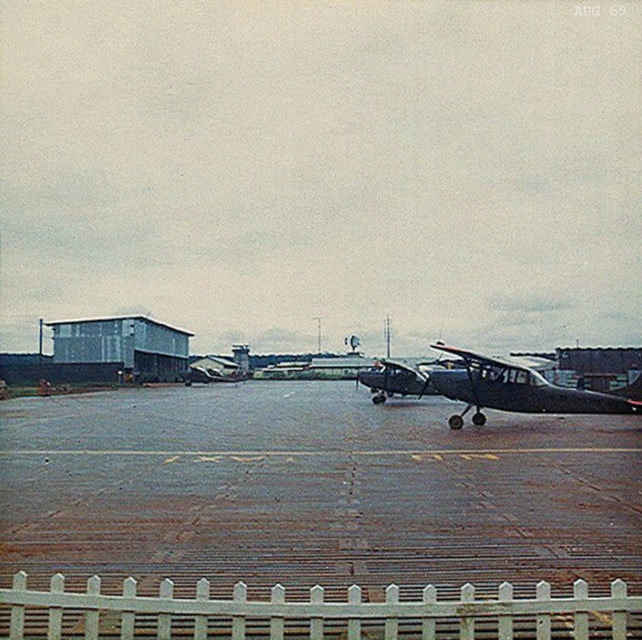
Can you confirm if dark gray asphalt runway at center is shorter than metallic gray airplane at center?

Indeed, dark gray asphalt runway at center has a lesser height compared to metallic gray airplane at center.

Can you confirm if dark gray asphalt runway at center is positioned to the left of metallic gray airplane at center?

Correct, you'll find dark gray asphalt runway at center to the left of metallic gray airplane at center.

Find the location of a particular element. Image resolution: width=642 pixels, height=640 pixels. dark gray asphalt runway at center is located at coordinates (313, 490).

Looking at this image, who is shorter, dark gray asphalt runway at center or metallic gray hangar at left?

With less height is dark gray asphalt runway at center.

Is point (578, 556) farther from viewer compared to point (137, 380)?

No, (578, 556) is closer to viewer.

The image size is (642, 640). Identify the location of dark gray asphalt runway at center. (313, 490).

Is metallic gray airplane at center to the right of metallic gray hangar at left from the viewer's perspective?

Correct, you'll find metallic gray airplane at center to the right of metallic gray hangar at left.

Is point (525, 396) behind point (137, 349)?

No, (525, 396) is closer to viewer.

This screenshot has width=642, height=640. Describe the element at coordinates (496, 387) in the screenshot. I see `metallic gray airplane at center` at that location.

This screenshot has height=640, width=642. What are the coordinates of `metallic gray airplane at center` in the screenshot? It's located at (496, 387).